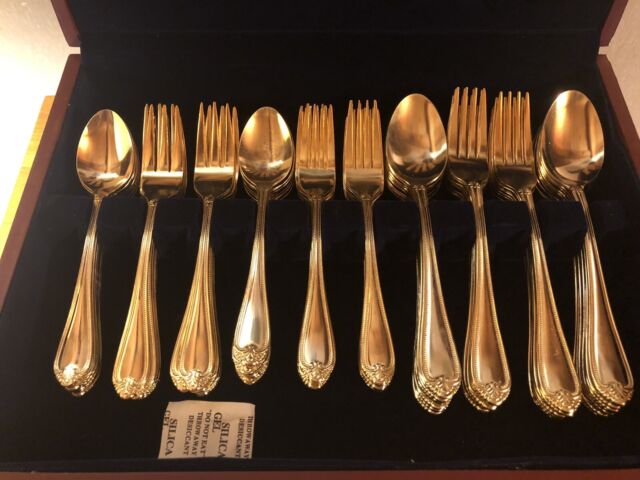
Where is `stack of forks`? The image size is (640, 480). stack of forks is located at coordinates (512, 149), (477, 144), (368, 161), (326, 158), (216, 162), (171, 163).